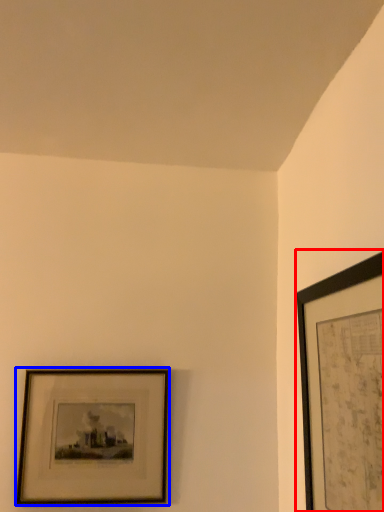
Question: Which point is further to the camera, picture frame (highlighted by a red box) or picture frame (highlighted by a blue box)?

Choices:
 (A) picture frame
 (B) picture frame

Answer: (B)